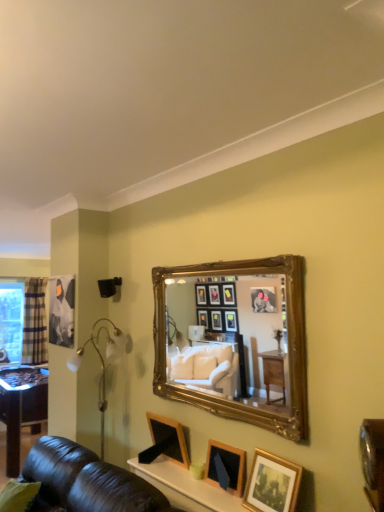
Question: Is clear plastic window screen at left closer to camera compared to gold-framed mirror at upper center?

Choices:
 (A) no
 (B) yes

Answer: (A)

Question: From the image's perspective, is clear plastic window screen at left on top of gold-framed mirror at upper center?

Choices:
 (A) yes
 (B) no

Answer: (B)

Question: From a real-world perspective, is clear plastic window screen at left below gold-framed mirror at upper center?

Choices:
 (A) no
 (B) yes

Answer: (B)

Question: Is clear plastic window screen at left positioned with its back to gold-framed mirror at upper center?

Choices:
 (A) yes
 (B) no

Answer: (B)

Question: Is clear plastic window screen at left smaller than gold-framed mirror at upper center?

Choices:
 (A) yes
 (B) no

Answer: (B)

Question: Is clear plastic window screen at left far from gold-framed mirror at upper center?

Choices:
 (A) no
 (B) yes

Answer: (B)

Question: Can you confirm if clear plastic window screen at left is thinner than wooden picture frame at lower center, the second picture frame positioned from the left?

Choices:
 (A) yes
 (B) no

Answer: (B)

Question: Are clear plastic window screen at left and wooden picture frame at lower center, which ranks as the 2th picture frame in front-to-back order, far apart?

Choices:
 (A) no
 (B) yes

Answer: (B)

Question: Is clear plastic window screen at left aimed at wooden picture frame at lower center, which ranks as the 2th picture frame in front-to-back order?

Choices:
 (A) yes
 (B) no

Answer: (A)

Question: Is clear plastic window screen at left shorter than wooden picture frame at lower center, arranged as the second picture frame when viewed from the right?

Choices:
 (A) yes
 (B) no

Answer: (B)

Question: Is clear plastic window screen at left directly adjacent to wooden picture frame at lower center, which ranks as the 2th picture frame in front-to-back order?

Choices:
 (A) yes
 (B) no

Answer: (B)

Question: Is clear plastic window screen at left smaller than wooden picture frame at lower center, the second picture frame positioned from the left?

Choices:
 (A) yes
 (B) no

Answer: (B)

Question: Is wooden picture frame at lower center, the first picture frame in the back-to-front sequence, wider than gold-framed mirror at upper center?

Choices:
 (A) yes
 (B) no

Answer: (B)